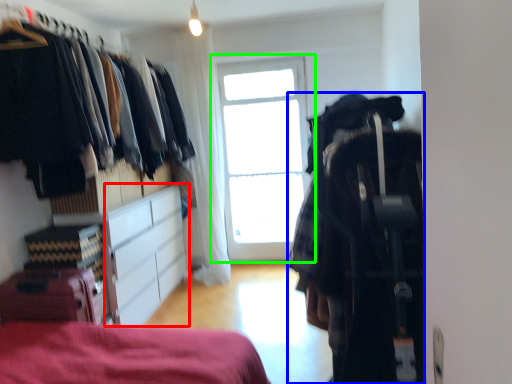
Question: Estimate the real-world distances between objects in this image. Which object is farther from cabinetry (highlighted by a red box), clothing (highlighted by a blue box) or window (highlighted by a green box)?

Choices:
 (A) clothing
 (B) window

Answer: (A)